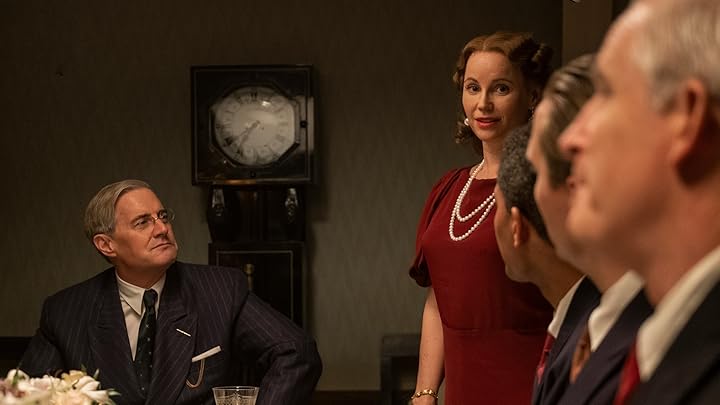
Where is `clock hands`? Image resolution: width=720 pixels, height=405 pixels. clock hands is located at coordinates (235, 137), (243, 142).